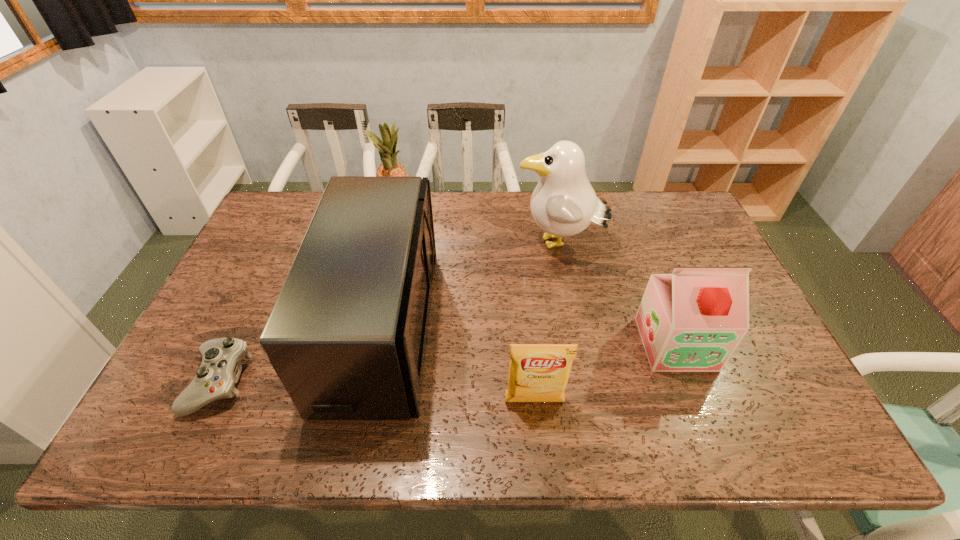
Identify the location of free region located on the right of the pineapple. Image resolution: width=960 pixels, height=540 pixels. click(x=451, y=213).

This screenshot has width=960, height=540. What are the coordinates of `vacant position located on the front-facing side of the microwave_oven` in the screenshot? It's located at (513, 327).

Locate an element on the screen. Image resolution: width=960 pixels, height=540 pixels. vacant space located with the cap open on the soya milk is located at coordinates (706, 422).

Identify the location of vacant region located on the front of the crisp (potato chip) with the logo. (538, 433).

I want to click on vacant region located 0.130m on the back of the control, so click(x=253, y=309).

Find the location of a particular element. gull that is at the far edge is located at coordinates (563, 204).

This screenshot has width=960, height=540. I want to click on pineapple at the far edge, so click(387, 149).

This screenshot has width=960, height=540. Identify the location of microwave_oven positioned at the near edge. (347, 335).

Find the location of `crisp (potato chip) at the near edge`. crisp (potato chip) at the near edge is located at coordinates (537, 372).

The width and height of the screenshot is (960, 540). Identify the location of control situated at the near edge. (220, 368).